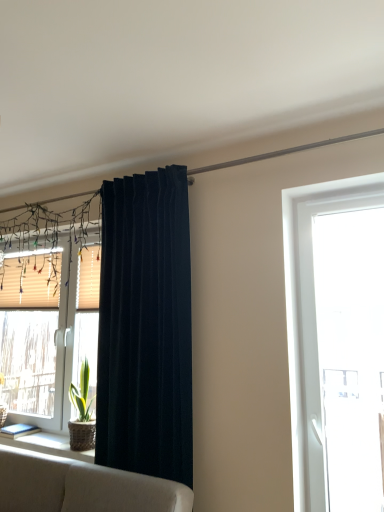
Question: From a real-world perspective, is transparent glass door at right, acting as the second window starting from the left, on beige textured blinds at left, placed as the first window when sorted from left to right?

Choices:
 (A) yes
 (B) no

Answer: (B)

Question: From a real-world perspective, is transparent glass door at right, which appears as the second window when viewed from the back, beneath beige textured blinds at left, acting as the first window starting from the back?

Choices:
 (A) yes
 (B) no

Answer: (A)

Question: Is the position of transparent glass door at right, the 1th window positioned from the right, more distant than that of beige textured blinds at left, acting as the first window starting from the back?

Choices:
 (A) no
 (B) yes

Answer: (A)

Question: From the image's perspective, would you say transparent glass door at right, the 1th window positioned from the right, is shown under beige textured blinds at left, the second window in the front-to-back sequence?

Choices:
 (A) yes
 (B) no

Answer: (B)

Question: Is transparent glass door at right, acting as the second window starting from the left, far from beige textured blinds at left, which appears as the second window when viewed from the right?

Choices:
 (A) no
 (B) yes

Answer: (B)

Question: Is transparent glass door at right, which appears as the second window when viewed from the back, shorter than beige textured blinds at left, the second window in the front-to-back sequence?

Choices:
 (A) no
 (B) yes

Answer: (A)

Question: From the image's perspective, is natural wood window sill at lower left on top of beige textured shutter at left, which is the 2th shutter in left-to-right order?

Choices:
 (A) no
 (B) yes

Answer: (A)

Question: Is natural wood window sill at lower left far from beige textured shutter at left, the first shutter positioned from the front?

Choices:
 (A) yes
 (B) no

Answer: (B)

Question: Is natural wood window sill at lower left oriented towards beige textured shutter at left, the first shutter positioned from the front?

Choices:
 (A) yes
 (B) no

Answer: (B)

Question: Is the surface of natural wood window sill at lower left in direct contact with beige textured shutter at left, acting as the first shutter starting from the right?

Choices:
 (A) no
 (B) yes

Answer: (A)

Question: Is beige textured shutter at left, marked as the 2th shutter in a back-to-front arrangement, located within natural wood window sill at lower left?

Choices:
 (A) yes
 (B) no

Answer: (B)

Question: From a real-world perspective, is natural wood window sill at lower left on top of beige textured shutter at left, which is the 2th shutter in left-to-right order?

Choices:
 (A) no
 (B) yes

Answer: (A)

Question: From the image's perspective, is transparent glass door at right, the 1th window positioned from the right, on dark blue velvet curtain at center?

Choices:
 (A) yes
 (B) no

Answer: (B)